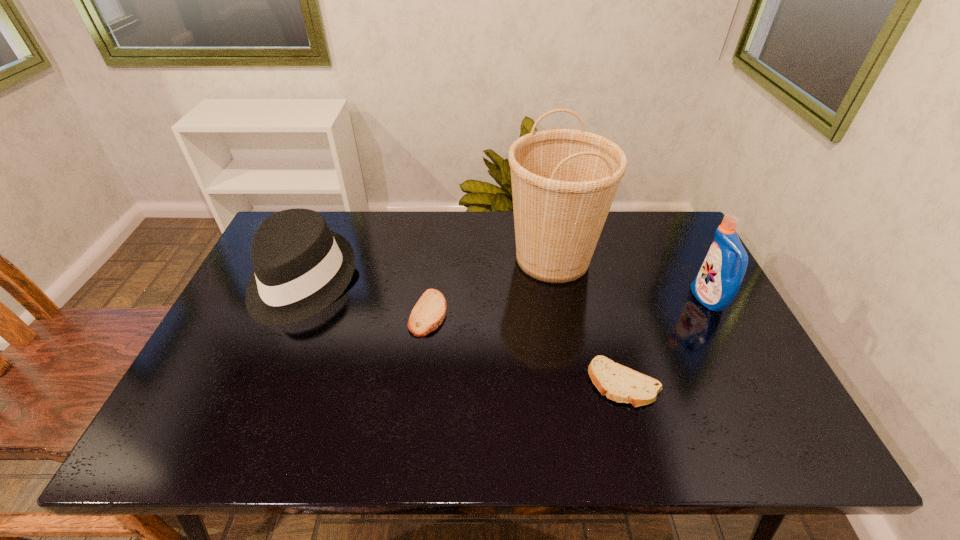
Find the location of a particular element. The width and height of the screenshot is (960, 540). vacant area that satisfies the following two spatial constraints: 1. on the front side of the shortest object; 2. on the left side of the farther pita bread is located at coordinates (420, 383).